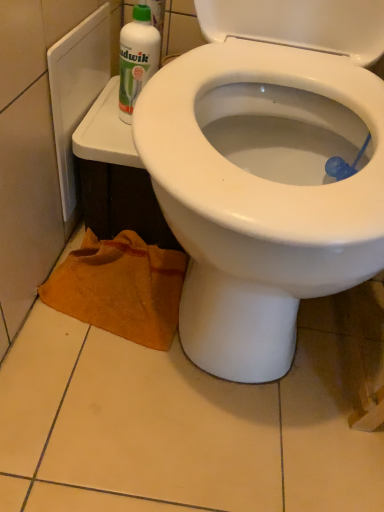
Question: Is white glossy bidet at center placed right next to white plastic bottle at upper left?

Choices:
 (A) yes
 (B) no

Answer: (B)

Question: Is white glossy bidet at center facing away from white plastic bottle at upper left?

Choices:
 (A) no
 (B) yes

Answer: (A)

Question: Could white plastic bottle at upper left be considered to be inside white glossy bidet at center?

Choices:
 (A) no
 (B) yes

Answer: (A)

Question: Are white glossy bidet at center and white plastic bottle at upper left far apart?

Choices:
 (A) yes
 (B) no

Answer: (B)

Question: From the image's perspective, is white glossy bidet at center located beneath white plastic bottle at upper left?

Choices:
 (A) yes
 (B) no

Answer: (A)

Question: Is white glossy bidet at center to the right of white plastic bottle at upper left from the viewer's perspective?

Choices:
 (A) no
 (B) yes

Answer: (B)

Question: Can you see white glossy bidet at center touching orange towel at lower left?

Choices:
 (A) yes
 (B) no

Answer: (B)

Question: Is orange towel at lower left at the back of white glossy bidet at center?

Choices:
 (A) yes
 (B) no

Answer: (B)

Question: Is white glossy bidet at center to the left of orange towel at lower left from the viewer's perspective?

Choices:
 (A) yes
 (B) no

Answer: (B)

Question: Is white glossy bidet at center surrounding orange towel at lower left?

Choices:
 (A) no
 (B) yes

Answer: (B)

Question: Is white glossy bidet at center further to the viewer compared to orange towel at lower left?

Choices:
 (A) no
 (B) yes

Answer: (A)

Question: Would you consider white glossy bidet at center to be distant from orange towel at lower left?

Choices:
 (A) no
 (B) yes

Answer: (A)

Question: Is orange towel at lower left closer to the viewer compared to white glossy bidet at center?

Choices:
 (A) no
 (B) yes

Answer: (A)